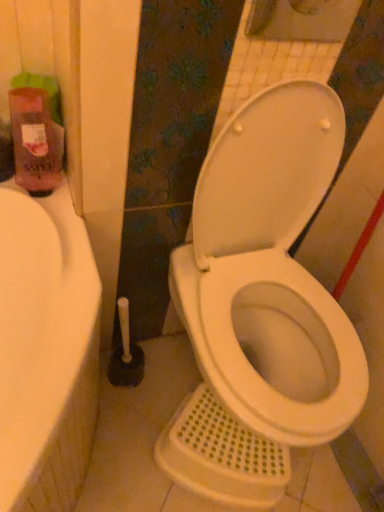
Question: From a real-world perspective, is pink matte bottle at left above or below white glossy toilet at center?

Choices:
 (A) above
 (B) below

Answer: (A)

Question: Considering the relative positions of pink matte bottle at left and white glossy toilet at center in the image provided, is pink matte bottle at left to the left or to the right of white glossy toilet at center?

Choices:
 (A) right
 (B) left

Answer: (B)

Question: Is point (16, 92) closer or farther from the camera than point (349, 325)?

Choices:
 (A) farther
 (B) closer

Answer: (B)

Question: In terms of size, does white glossy toilet at center appear bigger or smaller than pink matte bottle at left?

Choices:
 (A) big
 (B) small

Answer: (A)

Question: Looking at their shapes, would you say white glossy toilet at center is wider or thinner than pink matte bottle at left?

Choices:
 (A) wide
 (B) thin

Answer: (A)

Question: From a real-world perspective, relative to pink matte bottle at left, is white glossy toilet at center vertically above or below?

Choices:
 (A) above
 (B) below

Answer: (B)

Question: From the image's perspective, relative to pink matte bottle at left, is white glossy toilet at center above or below?

Choices:
 (A) below
 (B) above

Answer: (A)